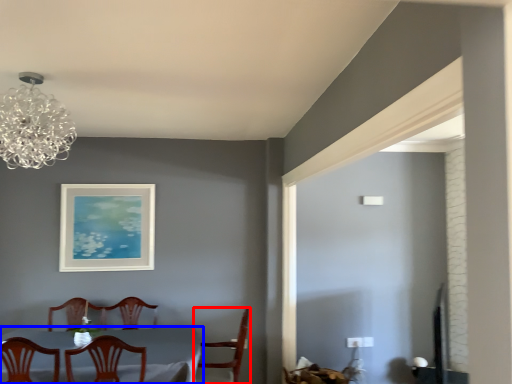
Question: Among these objects, which one is farthest to the camera, chair (highlighted by a red box) or table (highlighted by a blue box)?

Choices:
 (A) chair
 (B) table

Answer: (A)